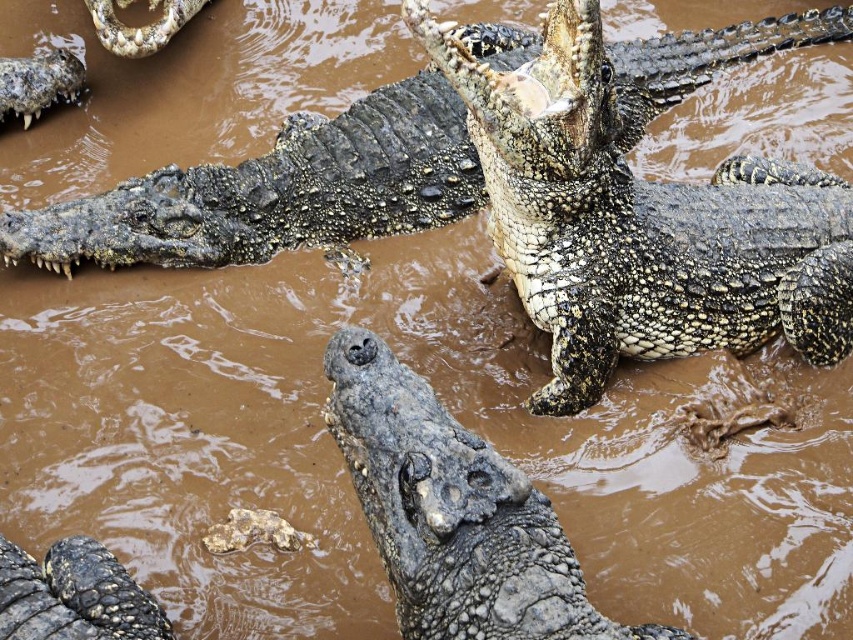
Question: Which of the following is the farthest from the observer?

Choices:
 (A) tap(334, 161)
 (B) tap(755, 44)
 (C) tap(86, 616)

Answer: (B)

Question: Is rough scaly crocodile at upper center smaller than rough textured crocodile at center?

Choices:
 (A) yes
 (B) no

Answer: (B)

Question: Which point is closer to the camera taking this photo?

Choices:
 (A) (555, 156)
 (B) (38, 600)
 (C) (584, 592)

Answer: (C)

Question: Does rough textured crocodile at center appear over dark gray scaly head at lower left?

Choices:
 (A) yes
 (B) no

Answer: (A)

Question: Is rough textured crocodile at center to the right of dark gray scaly head at lower left from the viewer's perspective?

Choices:
 (A) no
 (B) yes

Answer: (B)

Question: Among these objects, which one is nearest to the camera?

Choices:
 (A) rough scaly crocodile at upper right
 (B) dark gray scaly head at lower left
 (C) rough scaly crocodile at upper center

Answer: (B)